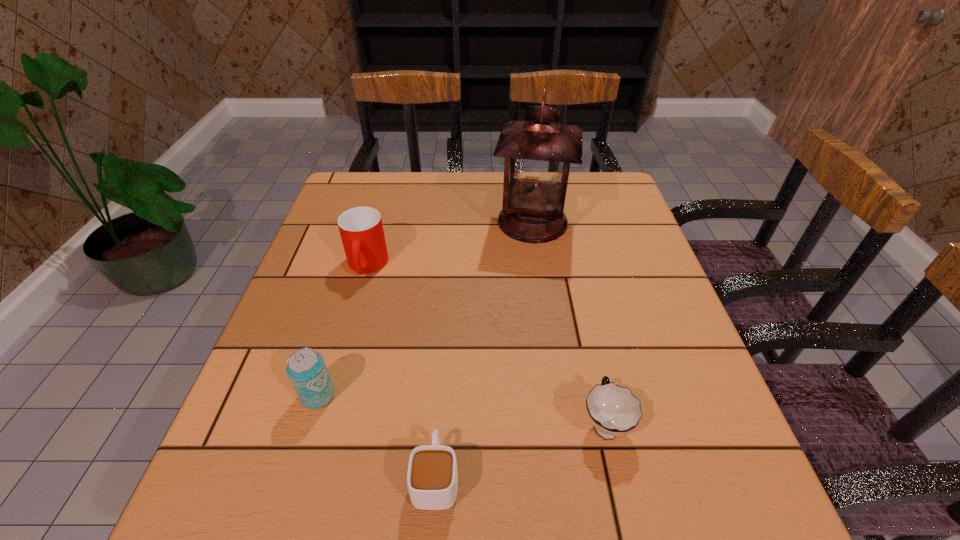
Locate an element on the screen. The image size is (960, 540). vacant point located between the third object from right to left and the beer can is located at coordinates 377,436.

This screenshot has height=540, width=960. What are the coordinates of `empty space that is in between the rightmost cup and the oil lamp` in the screenshot? It's located at (568, 322).

Identify the location of blank region between the farthest cup and the oil lamp. The image size is (960, 540). (449, 244).

In order to click on empty space between the tallest cup and the beer can in this screenshot , I will do `click(343, 331)`.

This screenshot has height=540, width=960. Find the location of `vacant area that lies between the third shortest object and the third object from left to right`. vacant area that lies between the third shortest object and the third object from left to right is located at coordinates (377, 436).

In order to click on free space that is in between the tallest object and the second cup from left to right in this screenshot , I will do `click(484, 349)`.

Identify the location of object that is the third closest to the third tallest object. This screenshot has height=540, width=960. (613, 410).

Locate an element on the screen. The image size is (960, 540). the fourth closest object relative to the third object from left to right is located at coordinates (538, 152).

The height and width of the screenshot is (540, 960). Find the location of `cup that is the closest one to the second cup from left to right`. cup that is the closest one to the second cup from left to right is located at coordinates (613, 410).

Where is `cup that can be found as the second closest to the rightmost cup`? The width and height of the screenshot is (960, 540). cup that can be found as the second closest to the rightmost cup is located at coordinates (361, 229).